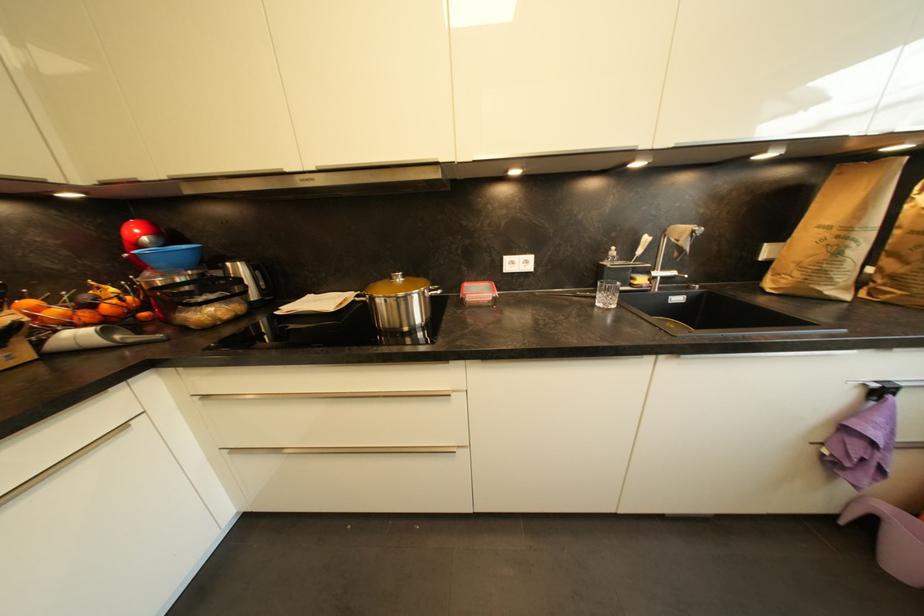
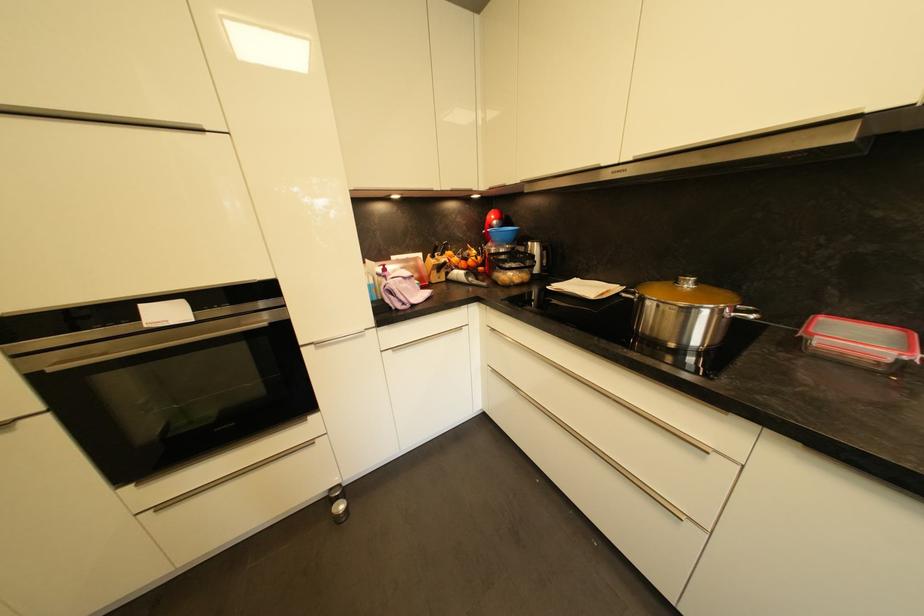
Question: I am providing you with two images of the same scene from different viewpoints. After the viewpoint changes to image2, which objects are now occluded?

Choices:
 (A) pot lid handle
 (B) orange fruit
 (C) knife handle
 (D) none of these

Answer: (D)